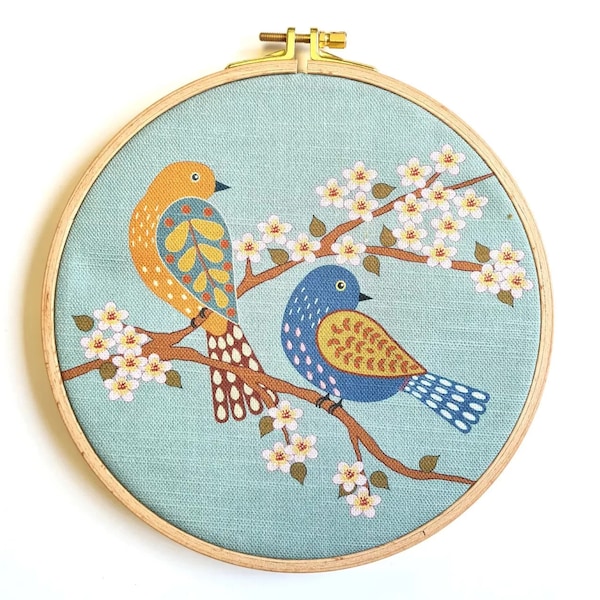
Locate an element on the screen. The image size is (600, 600). bracket is located at coordinates (312, 46).